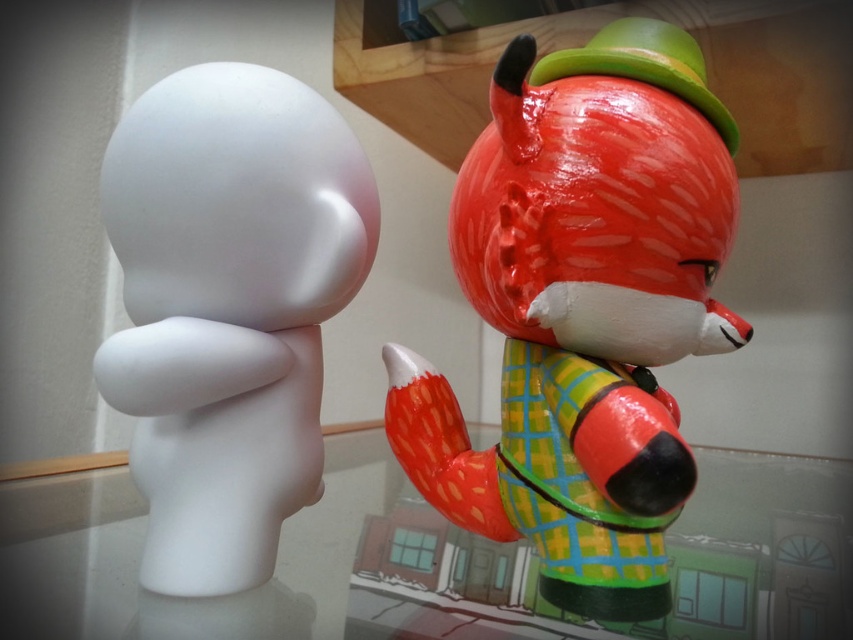
You are standing in front of the two figurines on the glass table. The point at coordinates point [625,304] is part of one of them. Which figurine is it closer to?

The point at coordinates point [625,304] is 23.23 inches from the viewer, so it is closer to the white rounded figurine on the left since it is positioned facing towards the right side of the frame and the fox figurine is on the right.

You are arranging these two items on a shelf. The shiny red fox at right needs to be placed on top of the matte white figure at left for display. Is this possible based on their current positions?

Yes, the shiny red fox at right is already positioned over the matte white figure at left, so placing it on top would be feasible.